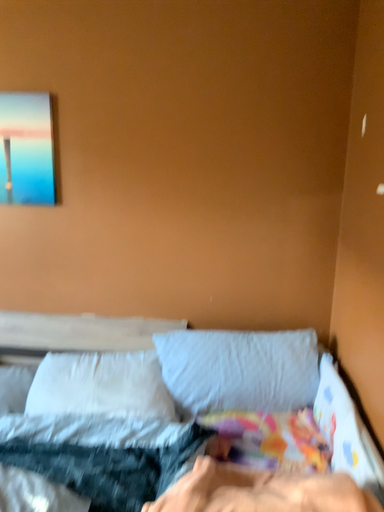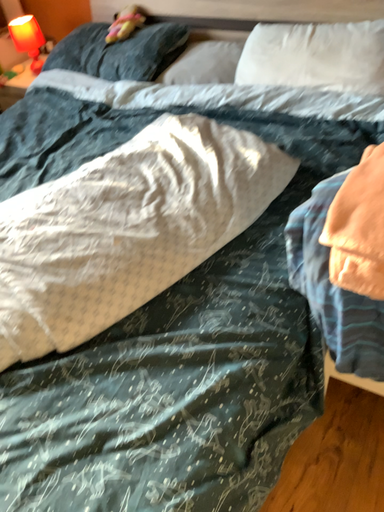
Question: How did the camera likely rotate when shooting the video?

Choices:
 (A) rotated left
 (B) rotated right

Answer: (A)